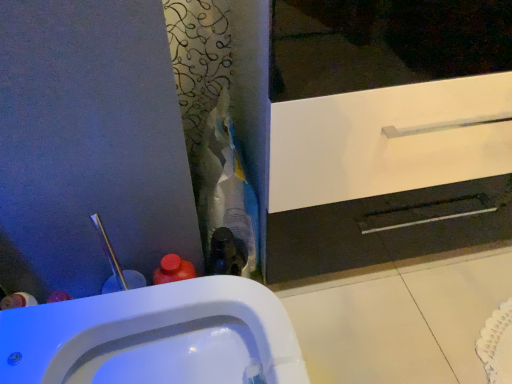
Locate an element on the screen. This screenshot has height=384, width=512. white glossy sink at lower left is located at coordinates (155, 337).

The image size is (512, 384). What do you see at coordinates (155, 337) in the screenshot? I see `white glossy sink at lower left` at bounding box center [155, 337].

From the picture: Measure the distance between point (216, 330) and camera.

A distance of 30.71 inches exists between point (216, 330) and camera.

Where is `white glossy cabinet at center`? white glossy cabinet at center is located at coordinates (388, 175).

What is the approximate width of white glossy cabinet at center?

white glossy cabinet at center is 14.25 inches wide.

The width and height of the screenshot is (512, 384). What do you see at coordinates (388, 175) in the screenshot? I see `white glossy cabinet at center` at bounding box center [388, 175].

The width and height of the screenshot is (512, 384). In order to click on white glossy sink at lower left in this screenshot , I will do `click(155, 337)`.

Can you confirm if white glossy cabinet at center is positioned to the left of white glossy sink at lower left?

No.

Considering the positions of objects white glossy cabinet at center and white glossy sink at lower left in the image provided, who is in front, white glossy cabinet at center or white glossy sink at lower left?

white glossy sink at lower left is more forward.

Considering the points (331, 210) and (298, 361), which point is behind, point (331, 210) or point (298, 361)?

The point (331, 210) is more distant.

From the image's perspective, relative to white glossy sink at lower left, is white glossy cabinet at center above or below?

white glossy cabinet at center is above white glossy sink at lower left.

From a real-world perspective, is white glossy cabinet at center beneath white glossy sink at lower left?

Actually, white glossy cabinet at center is physically above white glossy sink at lower left in the real world.

Consider the image. Can you confirm if white glossy cabinet at center is wider than white glossy sink at lower left?

No.

In the scene shown: Between white glossy cabinet at center and white glossy sink at lower left, which one has less height?

white glossy sink at lower left is shorter.

Can you confirm if white glossy cabinet at center is bigger than white glossy sink at lower left?

Yes.

Do you think white glossy cabinet at center is within white glossy sink at lower left, or outside of it?

white glossy cabinet at center cannot be found inside white glossy sink at lower left.

Does white glossy cabinet at center touch white glossy sink at lower left?

No, white glossy cabinet at center is not in contact with white glossy sink at lower left.

Is white glossy cabinet at center positioned with its back to white glossy sink at lower left?

That's not correct — white glossy cabinet at center is not looking away from white glossy sink at lower left.

How many degrees apart are the facing directions of white glossy cabinet at center and white glossy sink at lower left?

The angular difference between white glossy cabinet at center and white glossy sink at lower left is 90.7 degrees.

How much distance is there between white glossy cabinet at center and white glossy sink at lower left?

white glossy cabinet at center is 15.16 inches from white glossy sink at lower left.

This screenshot has height=384, width=512. Identify the location of bathroom cabinet that appears on the right of white glossy sink at lower left. (388, 175).

Between white glossy sink at lower left and white glossy cabinet at center, which one appears on the right side from the viewer's perspective?

Positioned to the right is white glossy cabinet at center.

Which object is more forward, white glossy sink at lower left or white glossy cabinet at center?

white glossy sink at lower left.

Is point (281, 331) less distant than point (412, 150)?

Yes.

From the image's perspective, is white glossy sink at lower left located above white glossy cabinet at center?

Incorrect, from the image's perspective, white glossy sink at lower left is lower than white glossy cabinet at center.

From a real-world perspective, between white glossy sink at lower left and white glossy cabinet at center, who is vertically higher?

white glossy cabinet at center is physically above.

Can you confirm if white glossy sink at lower left is wider than white glossy cabinet at center?

Yes, white glossy sink at lower left is wider than white glossy cabinet at center.

In terms of height, does white glossy sink at lower left look taller or shorter compared to white glossy cabinet at center?

Clearly, white glossy sink at lower left is shorter compared to white glossy cabinet at center.

Considering the relative sizes of white glossy sink at lower left and white glossy cabinet at center in the image provided, is white glossy sink at lower left smaller than white glossy cabinet at center?

Yes, white glossy sink at lower left is smaller than white glossy cabinet at center.

Does white glossy sink at lower left contain white glossy cabinet at center?

Definitely not — white glossy cabinet at center is not inside white glossy sink at lower left.

Does white glossy sink at lower left touch white glossy cabinet at center?

No, white glossy sink at lower left is not in contact with white glossy cabinet at center.

Is white glossy sink at lower left facing towards white glossy cabinet at center?

No, white glossy sink at lower left is not turned towards white glossy cabinet at center.

Looking at this image, can you tell me how much white glossy sink at lower left and white glossy cabinet at center differ in facing direction?

90.7 degrees.

How much distance is there between white glossy sink at lower left and white glossy cabinet at center?

white glossy sink at lower left and white glossy cabinet at center are 38.50 centimeters apart.

You are a GUI agent. You are given a task and a screenshot of the screen. Output one action in this format:
    pyautogui.click(x=<x>, y=<y>)
    Task: Click on the sink in front of the white glossy cabinet at center
    The width and height of the screenshot is (512, 384).
    Given the screenshot: What is the action you would take?
    pyautogui.click(x=155, y=337)

The width and height of the screenshot is (512, 384). What are the coordinates of `sink in front of the white glossy cabinet at center` in the screenshot? It's located at (155, 337).

Identify the location of sink located underneath the white glossy cabinet at center (from a real-world perspective). (155, 337).